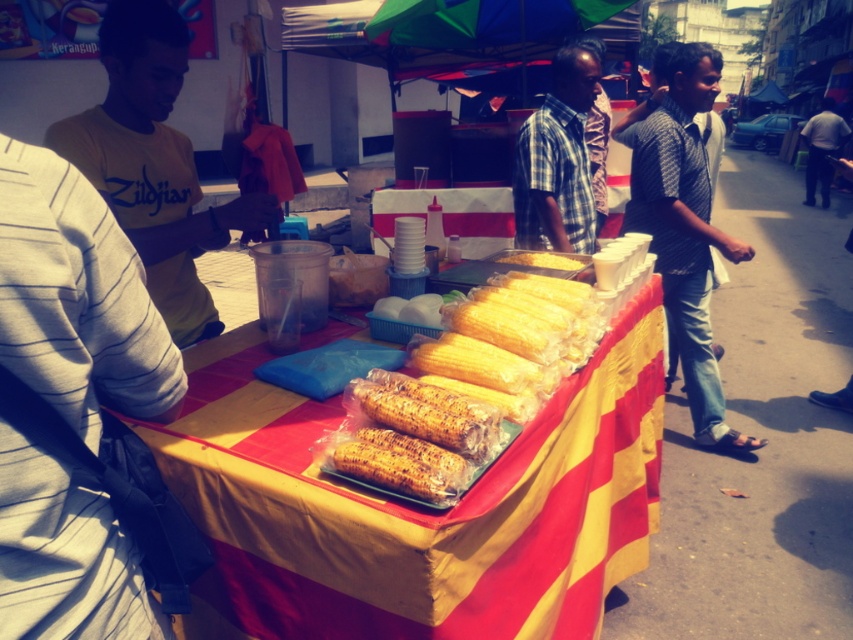
From the picture: You are a customer at the street food stall. You see the dark gray pants at right and the yellow matte corn at center. Which object is covering the other?

The dark gray pants at right is positioned over yellow matte corn at center, so the dark gray pants at right is covering the yellow matte corn at center.

You are a customer at the food stall. You want to place your dark gray pants at right on top of the yellow matte corn at center. Is this possible based on their sizes?

The dark gray pants at right is wider than the yellow matte corn at center, so placing the dark gray pants at right on top of the yellow matte corn at center may not be possible due to its larger width.